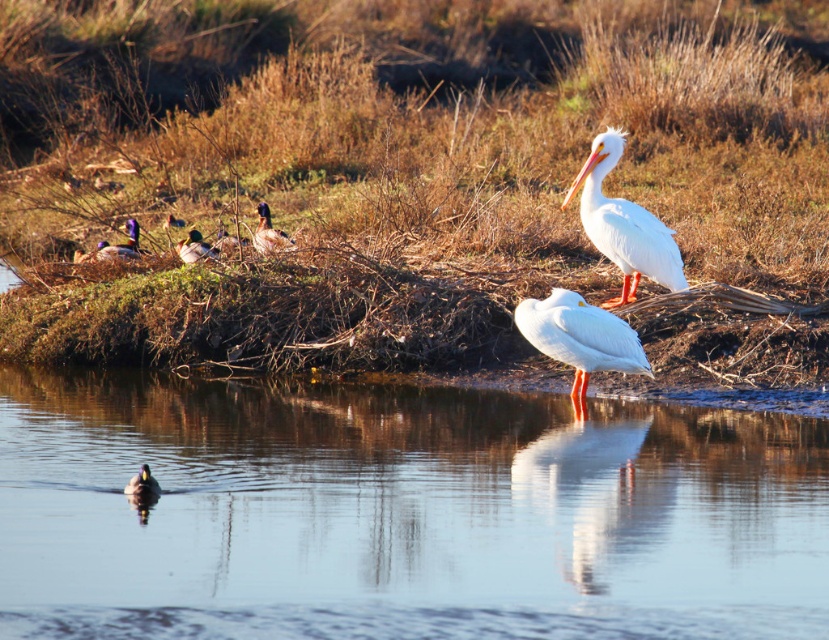
You are a birdwatcher observing the scene. You notice the green glossy duck at upper center and the brown glossy duck at lower left. Which duck is bigger?

The green glossy duck at upper center is larger in size compared to the brown glossy duck at lower left.

You are standing at the point with coordinates point[134,234] and want to walk towards the water. Is the point point[435,404] blocking your path?

Point[435,404] is in front of point[134,234], so yes, the point[435,404] is blocking the path to the water.

You are a wildlife photographer aiming to capture a photo of both the green glossy duck at upper center and the brown glossy duck at lower left in the same frame. Your camera has a zoom lens that can focus on objects up to 5 meters apart. Can you fit both ducks into the frame without moving the camera?

The green glossy duck at upper center and the brown glossy duck at lower left are 4.85 meters apart, which is within the 5 meters range of your camera lens. Therefore, you can fit both ducks into the frame without moving the camera.